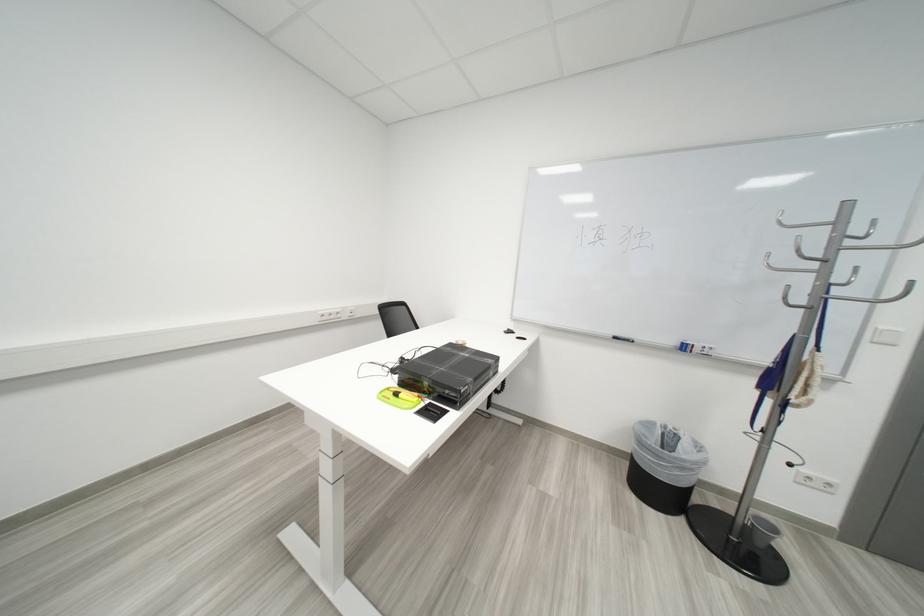
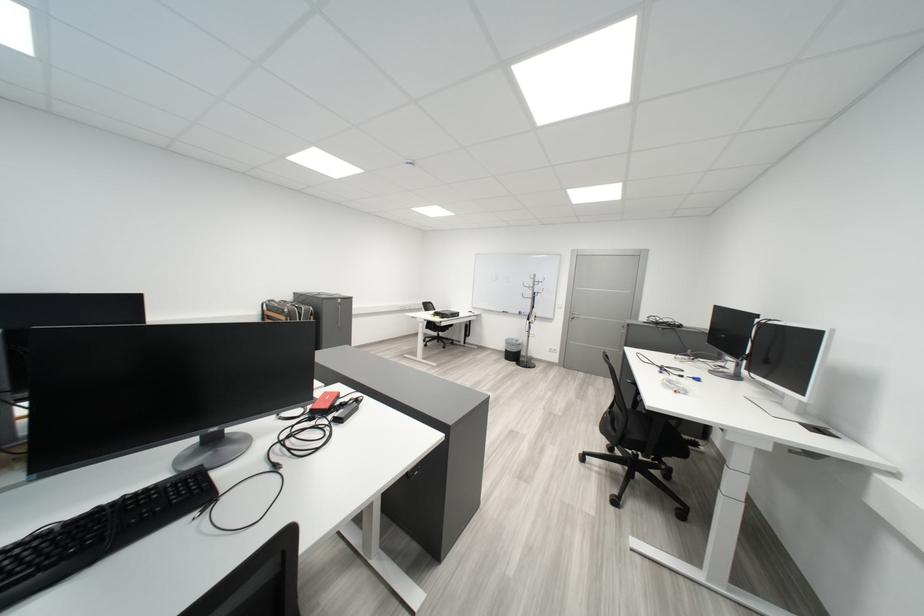
Question: Which direction would the cameraman need to move to produce the second image? Reply with the corresponding letter.

Choices:
 (A) Left
 (B) Right
 (C) Forward
 (D) Backward

Answer: (D)